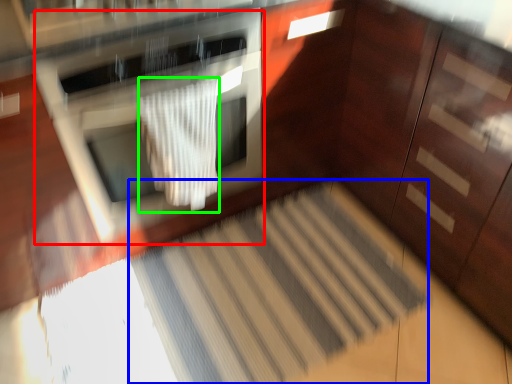
Question: Based on their relative distances, which object is farther from oven (highlighted by a red box)? Choose from stair (highlighted by a blue box) and blanket (highlighted by a green box).

Choices:
 (A) stair
 (B) blanket

Answer: (A)